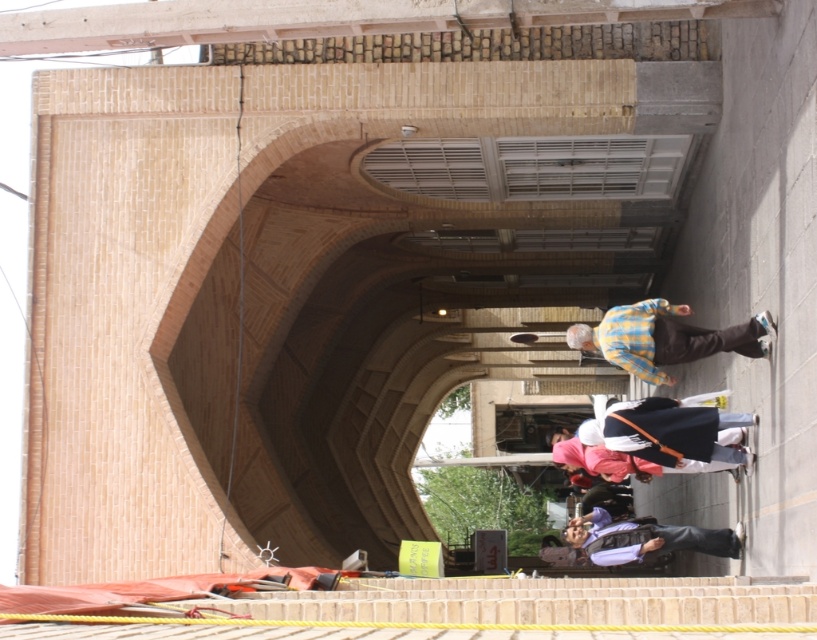
Does plaid shirt at center have a greater width compared to purple fabric pants at lower center?

Correct, the width of plaid shirt at center exceeds that of purple fabric pants at lower center.

Is point (694, 352) closer to viewer compared to point (706, 540)?

Yes.

Between point (676, 307) and point (623, 561), which one is positioned in front?

Point (676, 307) is more forward.

Find the location of a particular element. plaid shirt at center is located at coordinates (663, 337).